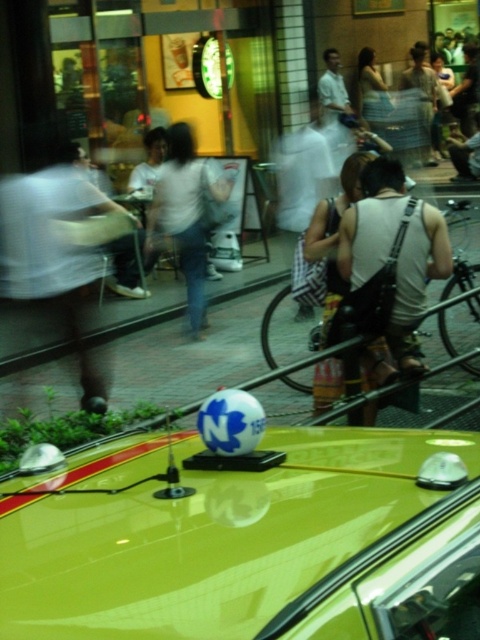
Question: Does matte white shirt at left appear on the right side of white matte tank top at center?

Choices:
 (A) yes
 (B) no

Answer: (B)

Question: Among these objects, which one is farthest from the camera?

Choices:
 (A) white cotton shirt at center
 (B) white tank top at center

Answer: (A)

Question: Which point is closer to the camera?

Choices:
 (A) (462, 458)
 (B) (167, 164)

Answer: (A)

Question: Does matte white shirt at left appear over white matte tank top at center?

Choices:
 (A) yes
 (B) no

Answer: (B)

Question: Among these points, which one is nearest to the camera?

Choices:
 (A) (303, 253)
 (B) (63, 314)
 (C) (400, 189)
 (D) (188, 253)

Answer: (C)

Question: Can you confirm if shiny yellow car at center is smaller than white matte tank top at center?

Choices:
 (A) no
 (B) yes

Answer: (B)